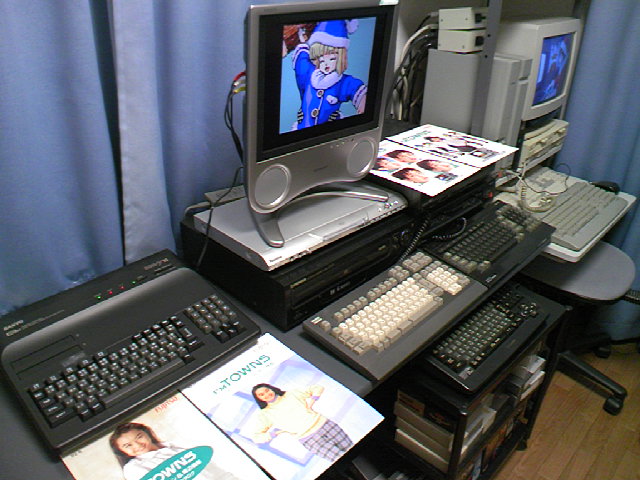
Identify the location of computer screen. point(316,80), point(550,67).